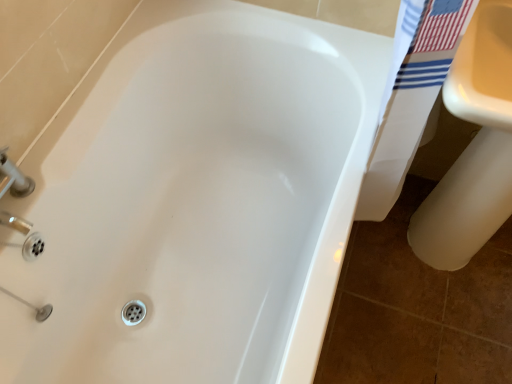
Where is `white glossy sink at lower right`? This screenshot has height=384, width=512. white glossy sink at lower right is located at coordinates (473, 147).

What do you see at coordinates (473, 147) in the screenshot?
I see `white glossy sink at lower right` at bounding box center [473, 147].

At what (x,y) coordinates should I click in order to perform the action: click on white glossy sink at lower right. Please return your answer as a coordinate pair (x, y). Looking at the image, I should click on (473, 147).